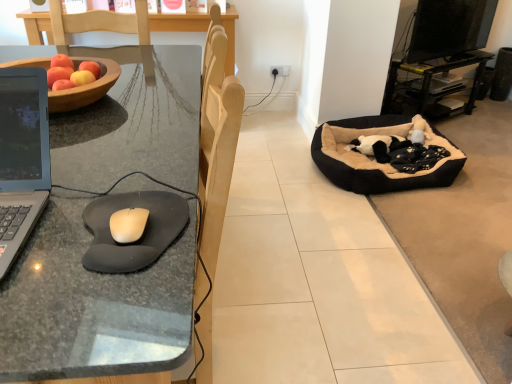
You are a GUI agent. You are given a task and a screenshot of the screen. Output one action in this format:
    pyautogui.click(x=<x>, y=<y>)
    Task: Click on the free space in front of black plush dog bed at right
    
    Given the screenshot: What is the action you would take?
    pyautogui.click(x=354, y=229)